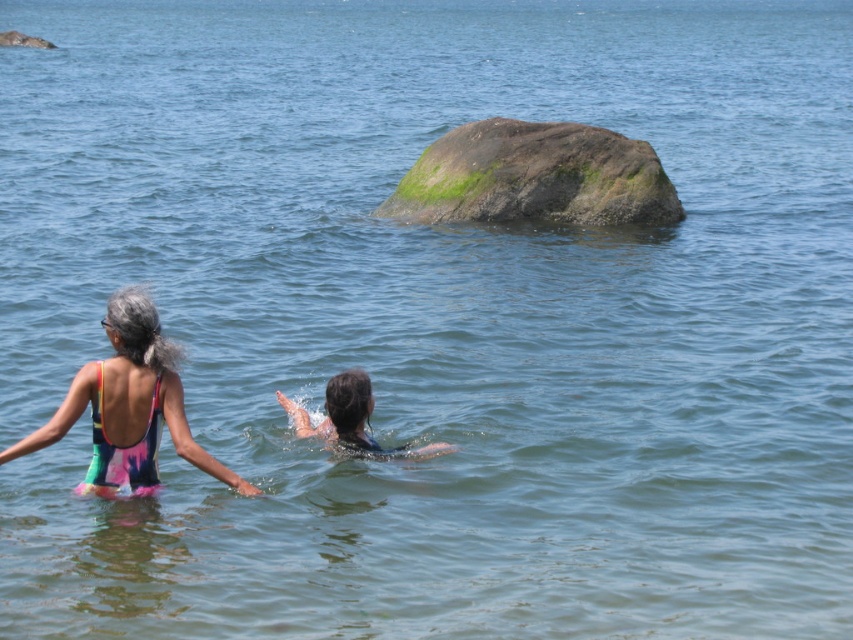
You are standing on the shore of the lake and see both the green mossy rock at center and the green mossy rock at upper left. Which rock is closer to you?

The green mossy rock at center is closer to you because it is positioned in front of the green mossy rock at upper left.

You are standing at the camera position and want to throw a pebble to hit the green mossy rock at center. If your throwing range is 20 meters, will you be able to reach the rock?

The green mossy rock at center is 19.65 meters away from the camera. Since your throwing range is 20 meters, you can reach the rock as 19.65 meters is within the 20 meters range.

You are a photographer trying to capture the scene from the shore. You notice the multicolored swimsuit at left and the dark blue swimsuit at center. Which swimmer is closer to the surface of the water?

The multicolored swimsuit at left is above the dark blue swimsuit at center, meaning it is closer to the surface of the water.